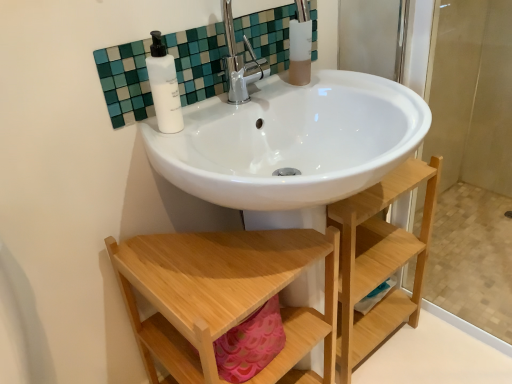
At what (x,y) coordinates should I click in order to perform the action: click on free point to the right of translucent frosted glass cup at upper center. Please return your answer as a coordinate pair (x, y). Looking at the image, I should click on [x=356, y=84].